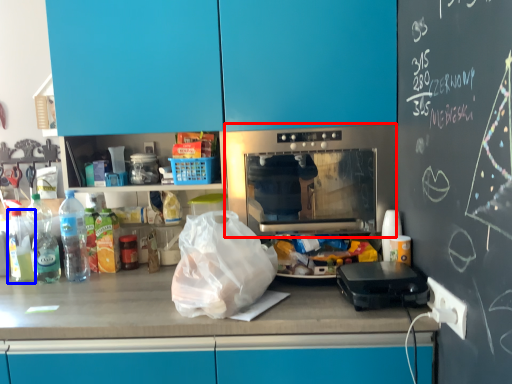
Question: Which object appears closest to the camera in this image, home appliance (highlighted by a red box) or bottle (highlighted by a blue box)?

Choices:
 (A) home appliance
 (B) bottle

Answer: (A)